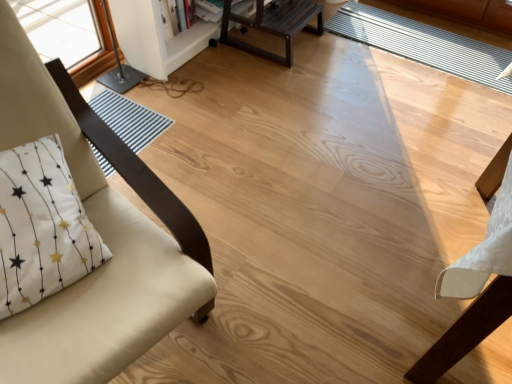
I want to click on free spot to the right of beige fabric chair at left, so click(x=295, y=275).